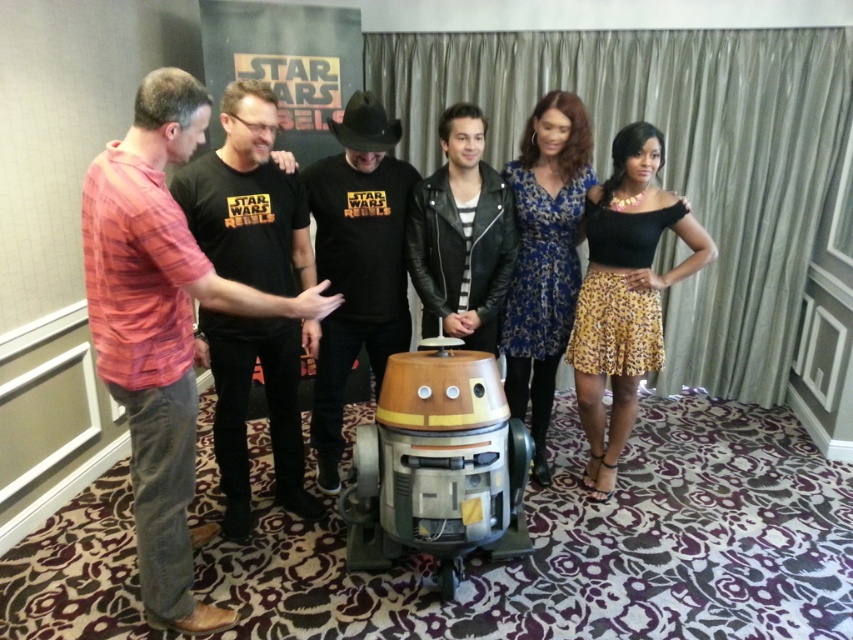
Looking at this image, where is the red plaid shirt at left located in the image?

The red plaid shirt at left is located at point [161,330].

You are a photographer setting up for a group photo. You need to ensure that the leather jacket at center and the black leopard print skirt at right are both visible in the final shot. Based on their positions, which one might need to be moved slightly forward to avoid being blocked?

The leather jacket at center is behind the black leopard print skirt at right, so the leather jacket at center might need to be moved slightly forward to avoid being blocked by the skirt.

You are a photographer at the Star Wars Rebels event. You need to ensure that all participants are visible in the photo. The black leopard print skirt at right and the black leather shirt at center are partially overlapping. Which one should you ask to move slightly to the left to make both visible?

The black leopard print skirt at right is smaller than the black leather shirt at center, so you should ask the person wearing the black leopard print skirt at right to move slightly to the left to make both visible.